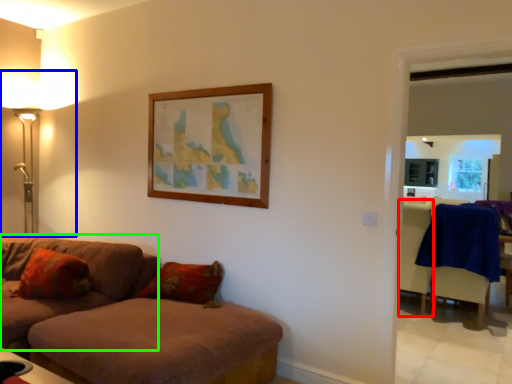
Question: Based on their relative distances, which object is farther from armchair (highlighted by a red box)? Choose from table lamp (highlighted by a blue box) and studio couch (highlighted by a green box).

Choices:
 (A) table lamp
 (B) studio couch

Answer: (A)